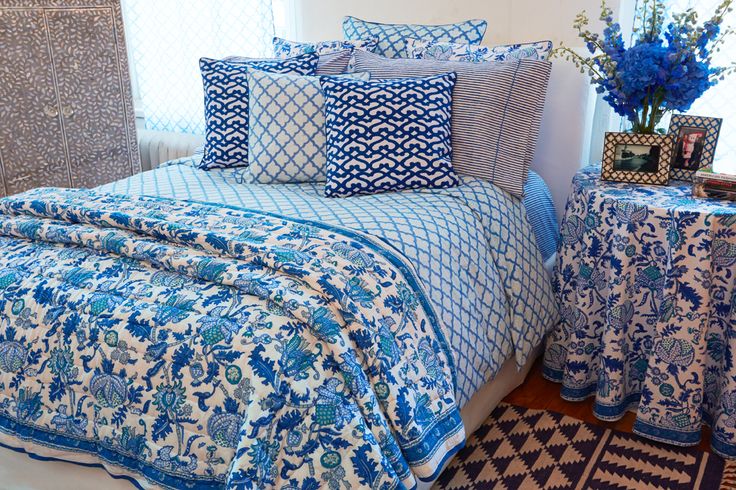
Image resolution: width=736 pixels, height=490 pixels. In order to click on tablecloth in this screenshot , I will do `click(633, 290)`.